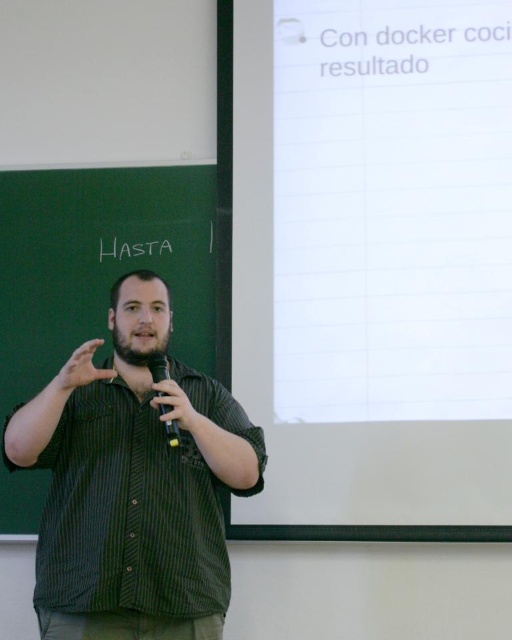
Based on the photo, you are a student sitting in the front row of the classroom. You notice the matte black hand at center and the black plastic microphone at center. Which object is nearer to you?

The matte black hand at center is closer to the viewer than the black plastic microphone at center.

You are a student sitting in the front row of the classroom. The teacher is wearing a green striped shirt at center and has a matte black hand at center. Which object is closer to the floor?

The green striped shirt at center is located below the matte black hand at center, so the green striped shirt at center is closer to the floor.